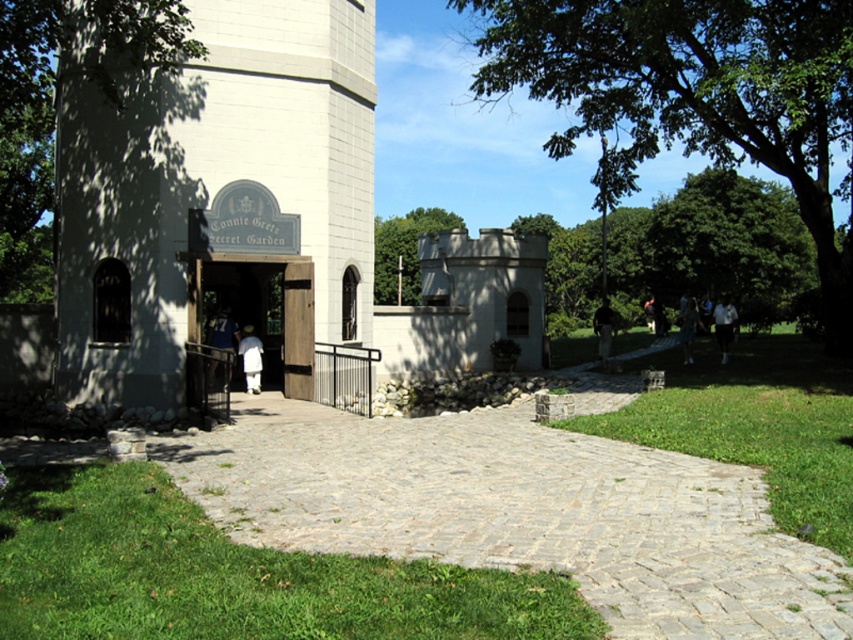
How far apart are white stone chapel at center and green leafy tree at left?

They are 4.67 meters apart.

Looking at this image, is white stone chapel at center positioned behind green leafy tree at left?

Yes, it is.

Who is more distant from viewer, (178, 124) or (105, 3)?

Positioned behind is point (178, 124).

You are a GUI agent. You are given a task and a screenshot of the screen. Output one action in this format:
    pyautogui.click(x=<x>, y=<y>)
    Task: Click on the white stone chapel at center
    Image resolution: width=853 pixels, height=640 pixels.
    Given the screenshot: What is the action you would take?
    pyautogui.click(x=218, y=198)

Who is higher up, green leafy tree at upper right or green leafy tree at left?

green leafy tree at upper right is above.

Can you confirm if green leafy tree at upper right is positioned below green leafy tree at left?

No.

The image size is (853, 640). What do you see at coordinates (692, 93) in the screenshot?
I see `green leafy tree at upper right` at bounding box center [692, 93].

At what (x,y) coordinates should I click in order to perform the action: click on green leafy tree at upper right. Please return your answer as a coordinate pair (x, y). Looking at the image, I should click on (692, 93).

Does gray cobblestone path at center have a larger size compared to wooden door at center?

Incorrect, gray cobblestone path at center is not larger than wooden door at center.

The width and height of the screenshot is (853, 640). What do you see at coordinates (518, 512) in the screenshot?
I see `gray cobblestone path at center` at bounding box center [518, 512].

At what (x,y) coordinates should I click in order to perform the action: click on gray cobblestone path at center. Please return your answer as a coordinate pair (x, y). This screenshot has height=640, width=853. Looking at the image, I should click on (518, 512).